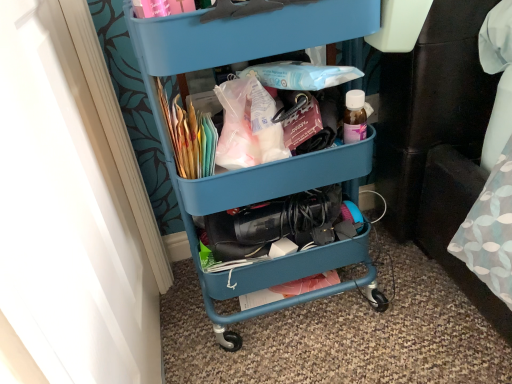
Where is `unoccupied region to the right of blue plastic cart at center`? unoccupied region to the right of blue plastic cart at center is located at coordinates (421, 302).